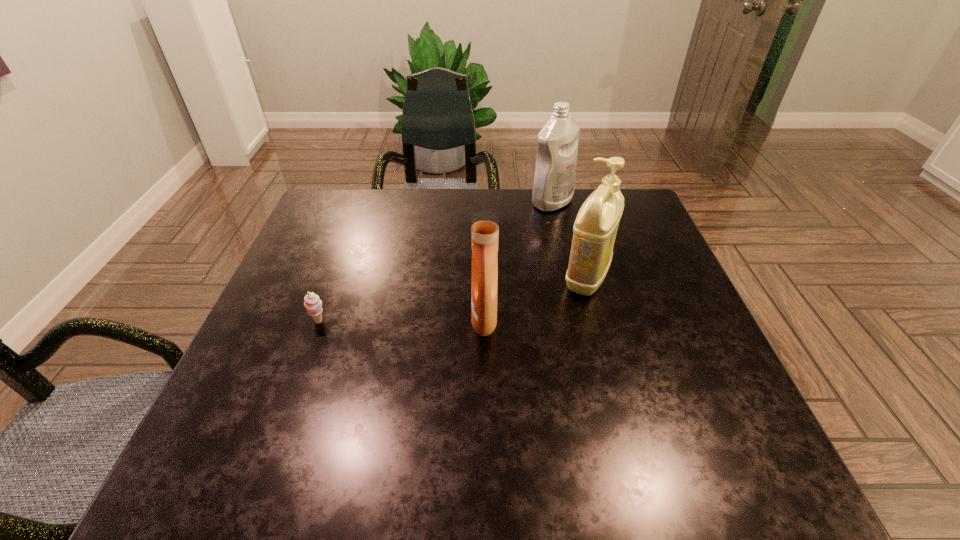
At what (x,y) coordinates should I click in order to perform the action: click on free space that is in between the third object from right to left and the farthest object. Please return your answer as a coordinate pair (x, y). Looking at the image, I should click on (518, 260).

Locate an element on the screen. The width and height of the screenshot is (960, 540). vacant space in between the shortest object and the farthest object is located at coordinates (436, 262).

In order to click on vacant point located between the third object from right to left and the farthest detergent in this screenshot , I will do `click(518, 260)`.

You are a GUI agent. You are given a task and a screenshot of the screen. Output one action in this format:
    pyautogui.click(x=<x>, y=<y>)
    Task: Click on the object that can be found as the second closest to the shortest object
    The width and height of the screenshot is (960, 540).
    Given the screenshot: What is the action you would take?
    [595, 228]

At what (x,y) coordinates should I click in order to perform the action: click on the third closest object to the third object from right to left. Please return your answer as a coordinate pair (x, y). The width and height of the screenshot is (960, 540). Looking at the image, I should click on (557, 145).

Find the location of a particular element. The image size is (960, 540). the third closest detergent relative to the shortest object is located at coordinates (557, 145).

Choose which detergent is the third nearest neighbor to the sherbert. Please provide its 2D coordinates. Your answer should be formatted as a tuple, i.e. [(x, y)], where the tuple contains the x and y coordinates of a point satisfying the conditions above.

[(557, 145)]

In order to click on vacant position in the image that satisfies the following two spatial constraints: 1. on the front-facing side of the third object from right to left; 2. on the front side of the shortest object in this screenshot , I will do `click(484, 322)`.